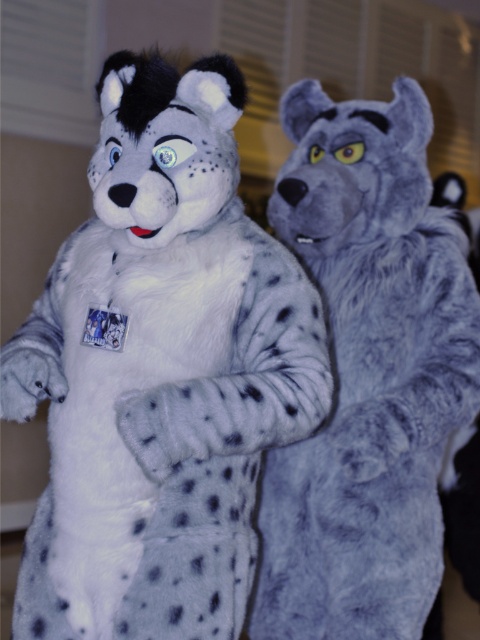
You are organizing a display in a museum and need to place the white soft plush toy at center and the fuzzy gray wolf at right on a shelf. The shelf has limited space. Based on their sizes, which object should you place first to ensure both fit properly?

The white soft plush toy at center should be placed first because it occupies less space than the fuzzy gray wolf at right, allowing more room for the larger wolf to be positioned afterward.

You are at a convention and want to place a white soft plush toy at center and a fuzzy gray wolf at right on a shelf. The shelf has limited space. Based on their positions in the image, which object should you place first to fit them both?

The white soft plush toy at center is positioned on the left side of fuzzy gray wolf at right, so you should place the white soft plush toy at center first on the left side of the shelf to accommodate their arrangement.